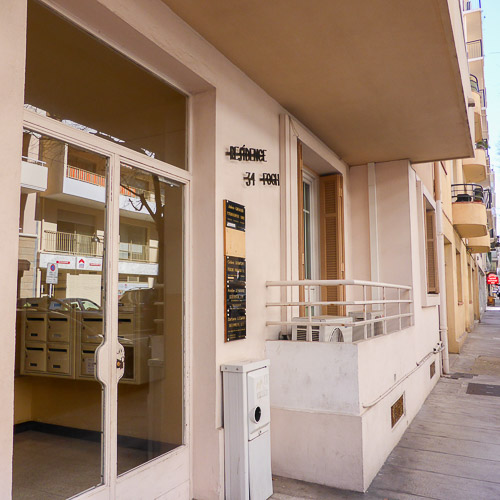
Locate an element on the screen. This screenshot has width=500, height=500. doors is located at coordinates (123, 410), (77, 435).